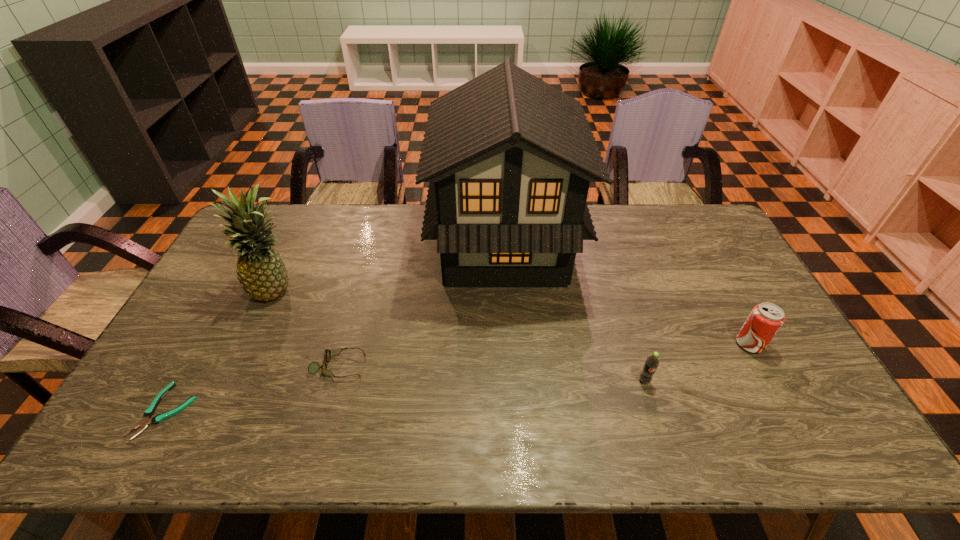
Identify which object is the third closest to the pineapple. Please provide its 2D coordinates. Your answer should be formatted as a tuple, i.e. [(x, y)], where the tuple contains the x and y coordinates of a point satisfying the conditions above.

[(509, 158)]

Find the location of `object that stands as the fourth closest to the third object from right to left`. object that stands as the fourth closest to the third object from right to left is located at coordinates pos(765,320).

Locate an element on the screen. The image size is (960, 540). vacant region that satisfies the following two spatial constraints: 1. on the front-facing side of the tallest object; 2. on the front side of the pineapple is located at coordinates (507, 290).

In order to click on vacant space that satisfies the following two spatial constraints: 1. on the back side of the shortest object; 2. on the left side of the fifth shortest object in this screenshot , I will do `click(233, 290)`.

Locate an element on the screen. blank area in the image that satisfies the following two spatial constraints: 1. on the back side of the pliers; 2. on the left side of the second tallest object is located at coordinates (233, 290).